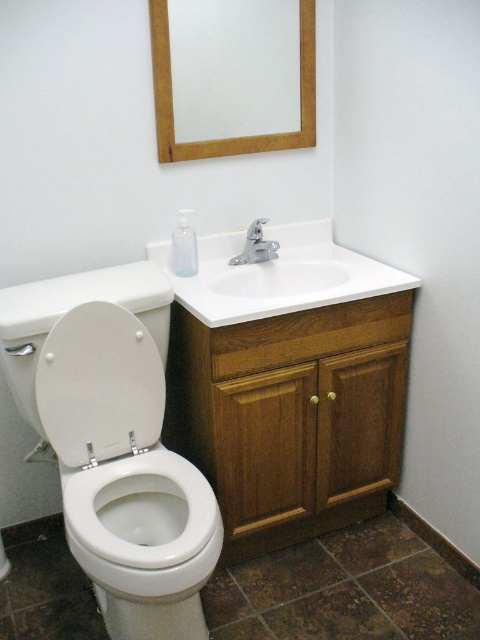
You are standing in the bathroom and want to reach both points. Which point, point (280,260) or point (253,244), is closer to you?

Point (280,260) is closer to you because it is further to the camera than point (253,244).

You are standing in a bathroom and want to clean the white glossy toilet bowl at lower left. If your cleaning spray can reach up to 5 feet, will you be able to spray it without moving closer?

The white glossy toilet bowl at lower left is 4.42 feet away from the camera, so yes, the spray can reach it since 4.42 feet is within the 5 feet range.